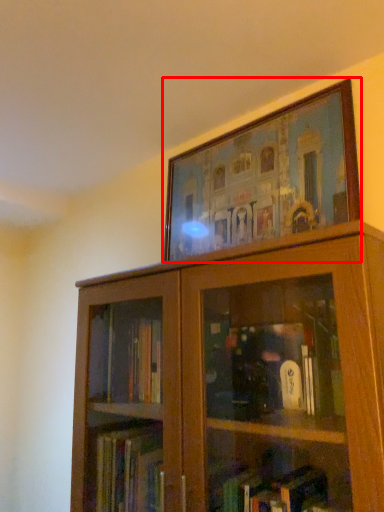
Question: From the image's perspective, where is picture frame (annotated by the red box) located relative to bookcase?

Choices:
 (A) below
 (B) above

Answer: (B)